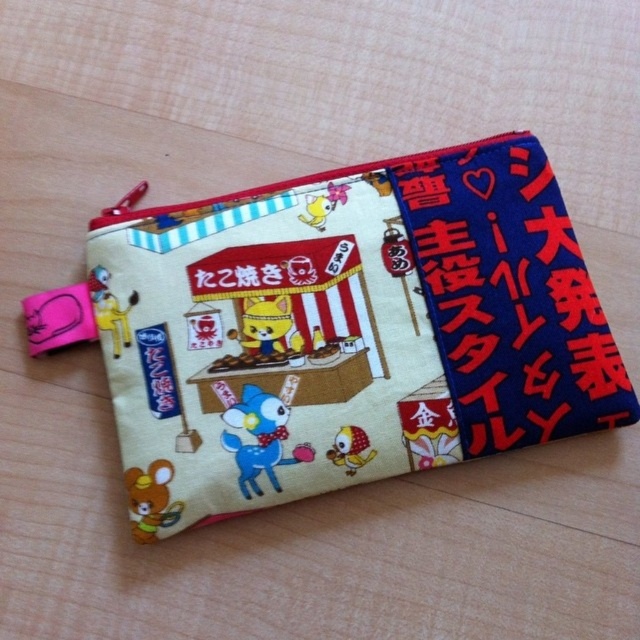
You are trying to read the text on the fabric pouch. Which object should you look at first, the matte fabric pouch at center or the blue fabric text at right?

The blue fabric text at right is positioned above the matte fabric pouch at center, so you should look at the blue fabric text at right first.

You have a small decorative item that needs to be placed on the same surface as the matte fabric pouch at center and the blue fabric text at right. If you want to place the item between them, will there be enough space?

The matte fabric pouch at center is wider than the blue fabric text at right, so there is sufficient space between them to place the item.